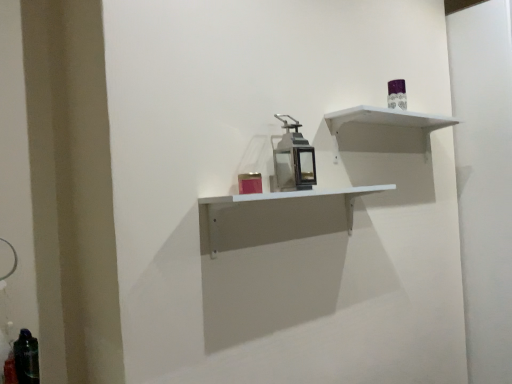
Question: Based on their sizes in the image, would you say metallic lantern at center is bigger or smaller than translucent dark green bottle at lower left?

Choices:
 (A) big
 (B) small

Answer: (A)

Question: Is point (285, 180) closer or farther from the camera than point (35, 382)?

Choices:
 (A) closer
 (B) farther

Answer: (B)

Question: Which object is positioned farthest from the translucent dark green bottle at lower left?

Choices:
 (A) white matte shelf at upper right, which is the 2th shelf from bottom to top
 (B) metallic lantern at center
 (C) white matte shelf at center, the 1th shelf from the bottom

Answer: (A)

Question: Estimate the real-world distances between objects in this image. Which object is closer to the metallic lantern at center?

Choices:
 (A) translucent dark green bottle at lower left
 (B) white matte shelf at upper right, placed as the first shelf when sorted from top to bottom
 (C) white matte shelf at center, the 1th shelf from the bottom

Answer: (C)